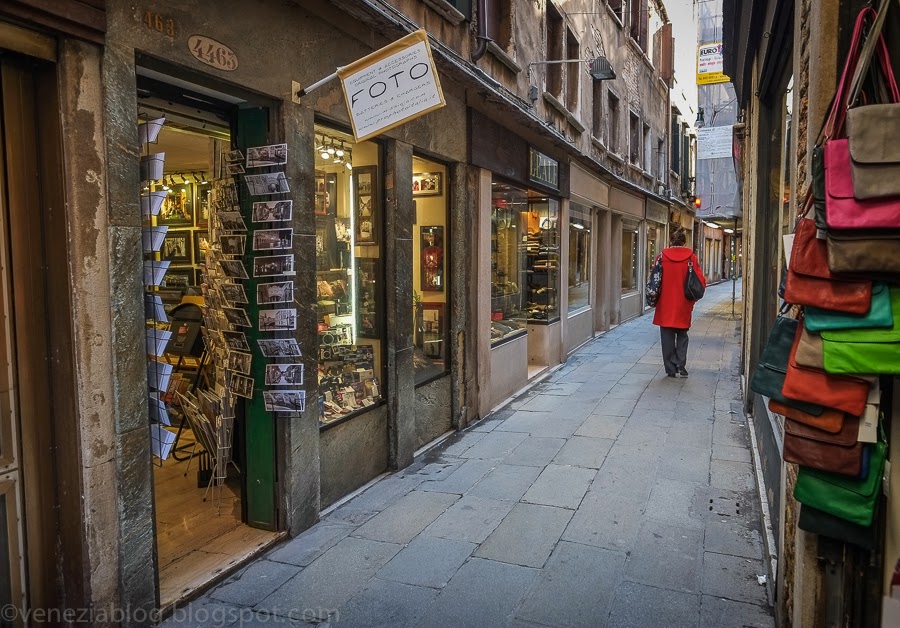
The image size is (900, 628). I want to click on window, so click(347, 264).